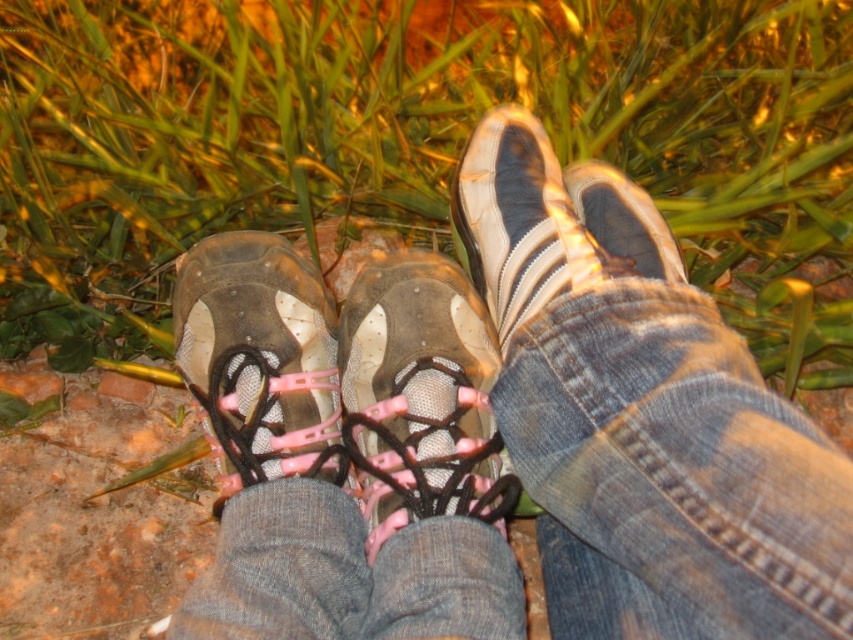
Question: Is green grass at center above white matte shoe at center?

Choices:
 (A) yes
 (B) no

Answer: (A)

Question: Which point is farther to the camera?

Choices:
 (A) (248, 339)
 (B) (527, 365)
 (C) (390, 392)
 (D) (473, 22)

Answer: (D)

Question: Is matte mesh shoe at center closer to the viewer compared to matte rubber shoe at center?

Choices:
 (A) yes
 (B) no

Answer: (A)

Question: Which object is closer to the camera taking this photo?

Choices:
 (A) green grass at center
 (B) pink mesh sneakers at center

Answer: (B)

Question: Which point is farther to the camera?

Choices:
 (A) matte mesh shoe at center
 (B) pink mesh sneakers at center
 (C) matte rubber shoe at center

Answer: (C)

Question: Is green grass at center further to camera compared to pink mesh sneakers at center?

Choices:
 (A) yes
 (B) no

Answer: (A)